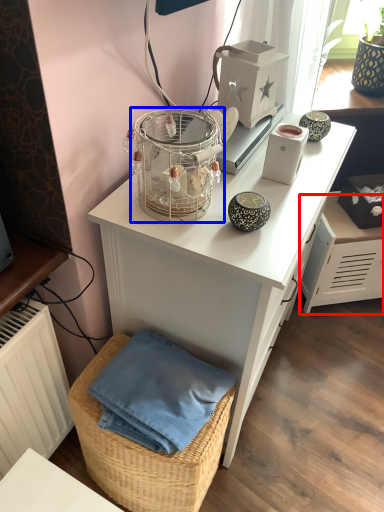
Question: Among these objects, which one is nearest to the camera, file cabinet (highlighted by a red box) or bird cage (highlighted by a blue box)?

Choices:
 (A) file cabinet
 (B) bird cage

Answer: (B)